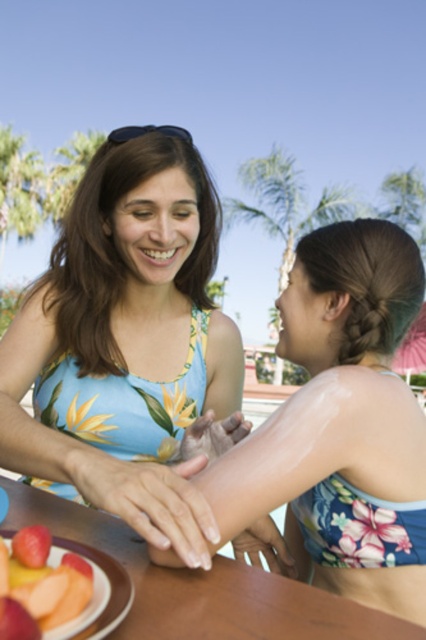
You are planning to place a new decorative item on the wooden table at center. Considering the size of the floral bikini top at center, will the item fit on the table?

The floral bikini top at center has a larger size compared to wooden table at center, so the decorative item may not fit if it is as large as the bikini top, since the table is smaller.

You are a guest at a poolside party and see the blue floral swimsuit at center and the wooden table at center. Which object is closer to you?

The blue floral swimsuit at center is closer to you because the wooden table at center is behind it.